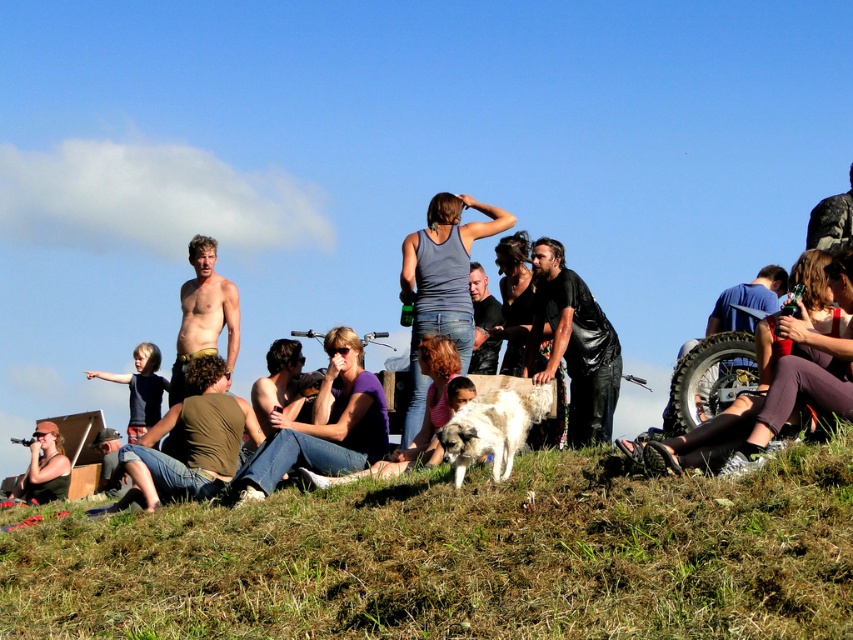
Question: Can you confirm if black leather jacket at center is wider than shiny skin torso at center?

Choices:
 (A) yes
 (B) no

Answer: (B)

Question: Among these points, which one is farthest from the camera?

Choices:
 (A) (476, 452)
 (B) (231, 417)
 (C) (535, 266)
 (D) (486, 333)

Answer: (D)

Question: Is green grassy hillside at lower center to the left of black leather jacket at center from the viewer's perspective?

Choices:
 (A) no
 (B) yes

Answer: (B)

Question: Which object is farther from the camera taking this photo?

Choices:
 (A) black leather jacket at center
 (B) green cotton shirt at lower left

Answer: (A)

Question: Which of these objects is positioned closest to the white fur dog at center?

Choices:
 (A) green cotton shirt at lower left
 (B) dark brown leather jacket at center
 (C) black leather jacket at center

Answer: (A)

Question: From the image, what is the correct spatial relationship of black leather jacket at center in relation to shiny skin torso at center?

Choices:
 (A) above
 (B) below

Answer: (A)